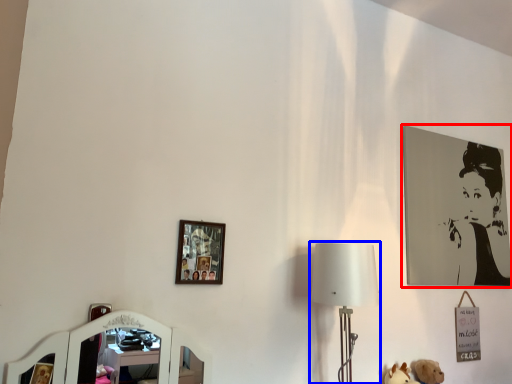
Question: Which object is closer to the camera taking this photo, picture frame (highlighted by a red box) or table lamp (highlighted by a blue box)?

Choices:
 (A) picture frame
 (B) table lamp

Answer: (B)